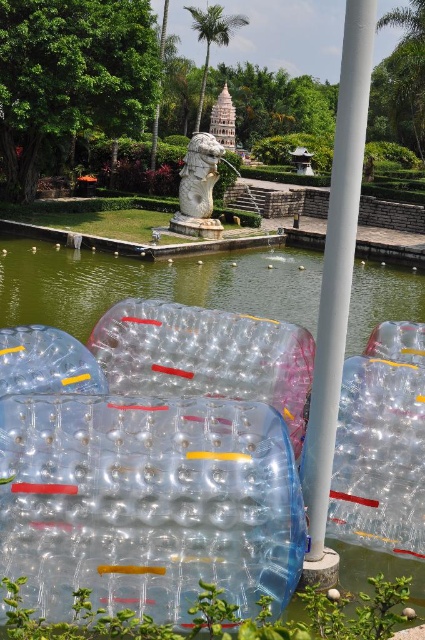
Does transparent plastic water at center have a lesser width compared to white smooth pole at center?

No, transparent plastic water at center is not thinner than white smooth pole at center.

Does point (393, 285) come in front of point (356, 99)?

No, (393, 285) is behind (356, 99).

Find the location of `transparent plastic water at center`. transparent plastic water at center is located at coordinates (152, 284).